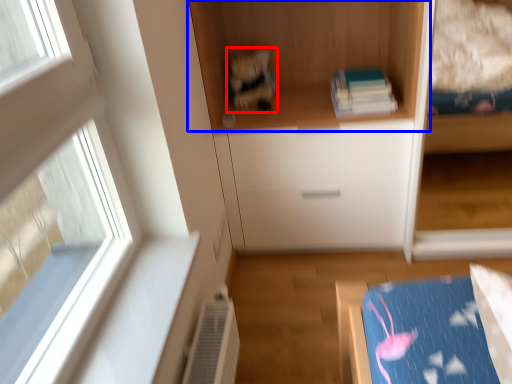
Question: Which object is further to the camera taking this photo, toy (highlighted by a red box) or cupboard (highlighted by a blue box)?

Choices:
 (A) toy
 (B) cupboard

Answer: (A)